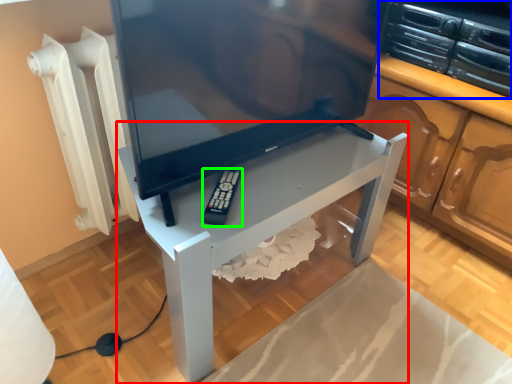
Question: Based on their relative distances, which object is nearer to furniture (highlighted by a red box)? Choose from appliance (highlighted by a blue box) and equipment (highlighted by a green box).

Choices:
 (A) appliance
 (B) equipment

Answer: (B)